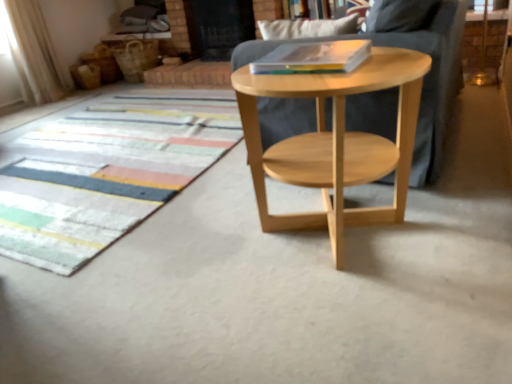
Question: From a real-world perspective, does transparent glass screen door at upper center sit lower than multicolored woven mat at lower left?

Choices:
 (A) yes
 (B) no

Answer: (B)

Question: Is transparent glass screen door at upper center positioned behind multicolored woven mat at lower left?

Choices:
 (A) yes
 (B) no

Answer: (A)

Question: Is transparent glass screen door at upper center smaller than multicolored woven mat at lower left?

Choices:
 (A) no
 (B) yes

Answer: (A)

Question: Is transparent glass screen door at upper center surrounding multicolored woven mat at lower left?

Choices:
 (A) yes
 (B) no

Answer: (B)

Question: Could you tell me if transparent glass screen door at upper center is turned towards multicolored woven mat at lower left?

Choices:
 (A) yes
 (B) no

Answer: (A)

Question: From the image's perspective, is hardcover book at center above or below natural wood side table at center?

Choices:
 (A) above
 (B) below

Answer: (A)

Question: Considering the positions of point (293, 51) and point (333, 140), is point (293, 51) closer or farther from the camera than point (333, 140)?

Choices:
 (A) closer
 (B) farther

Answer: (B)

Question: Considering their positions, is hardcover book at center located in front of or behind natural wood side table at center?

Choices:
 (A) front
 (B) behind

Answer: (B)

Question: Looking at the image, does hardcover book at center seem bigger or smaller compared to natural wood side table at center?

Choices:
 (A) big
 (B) small

Answer: (B)

Question: Considering their positions, is hardcover book at center located in front of or behind multicolored woven mat at lower left?

Choices:
 (A) behind
 (B) front

Answer: (B)

Question: From their relative heights in the image, would you say hardcover book at center is taller or shorter than multicolored woven mat at lower left?

Choices:
 (A) tall
 (B) short

Answer: (A)

Question: From the image's perspective, relative to multicolored woven mat at lower left, is hardcover book at center above or below?

Choices:
 (A) above
 (B) below

Answer: (A)

Question: Is hardcover book at center inside or outside of multicolored woven mat at lower left?

Choices:
 (A) outside
 (B) inside

Answer: (A)

Question: In terms of height, does multicolored woven mat at lower left look taller or shorter compared to transparent glass screen door at upper center?

Choices:
 (A) tall
 (B) short

Answer: (B)

Question: Is multicolored woven mat at lower left spatially inside transparent glass screen door at upper center, or outside of it?

Choices:
 (A) inside
 (B) outside

Answer: (B)